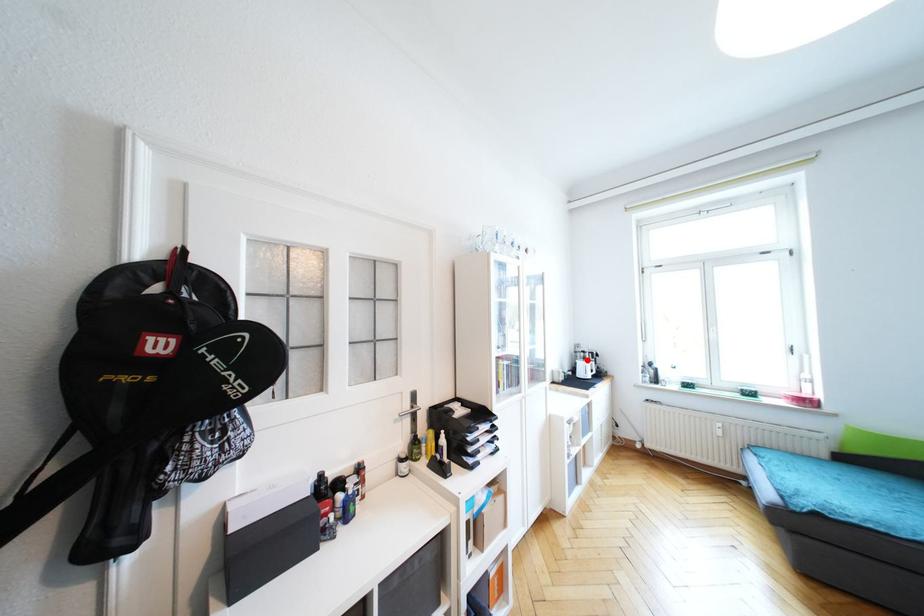
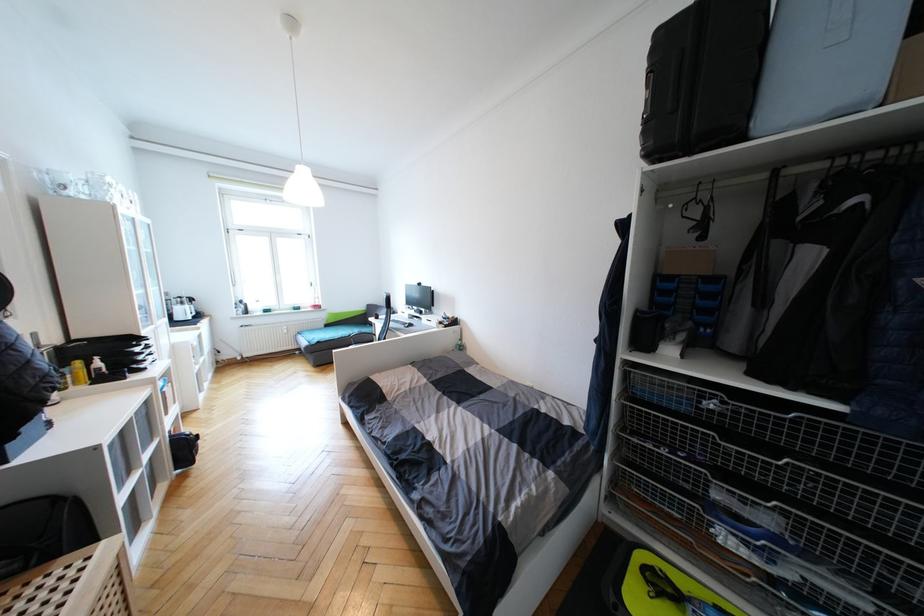
Question: I am providing you with two images of the same scene from different viewpoints. In image1, a red point is highlighted. Considering the same 3D point in image2, which of the following is correct?

Choices:
 (A) It is closer
 (B) It is farther

Answer: (A)